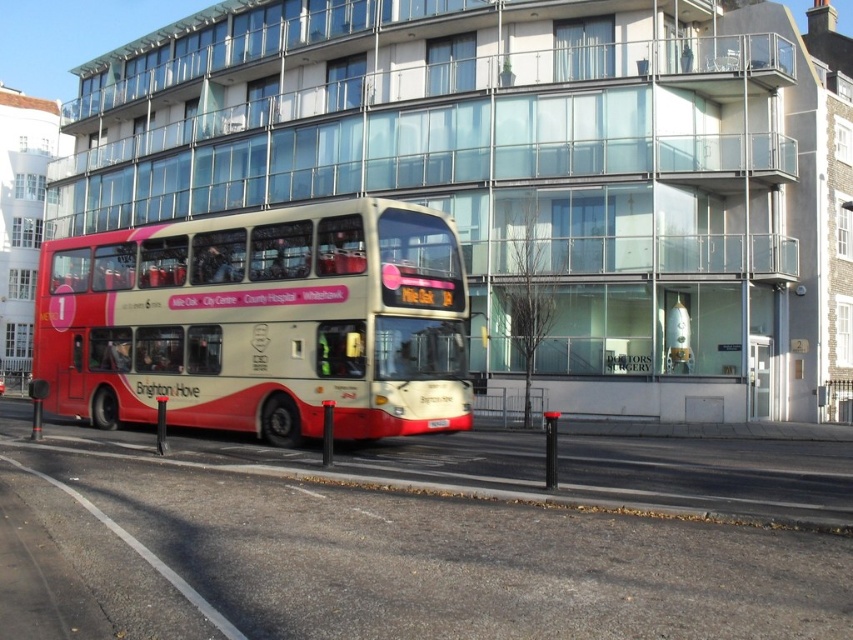
Question: Is red matte bus at center wider than white plastic license plate at center?

Choices:
 (A) no
 (B) yes

Answer: (B)

Question: Does red matte bus at center come behind white plastic license plate at center?

Choices:
 (A) no
 (B) yes

Answer: (A)

Question: Is red matte bus at center to the left of white plastic license plate at center from the viewer's perspective?

Choices:
 (A) no
 (B) yes

Answer: (B)